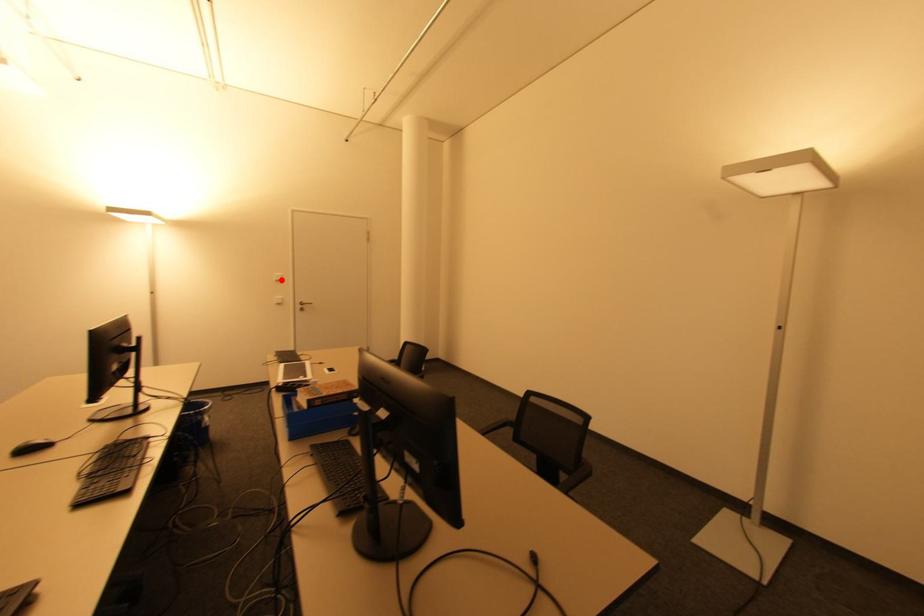
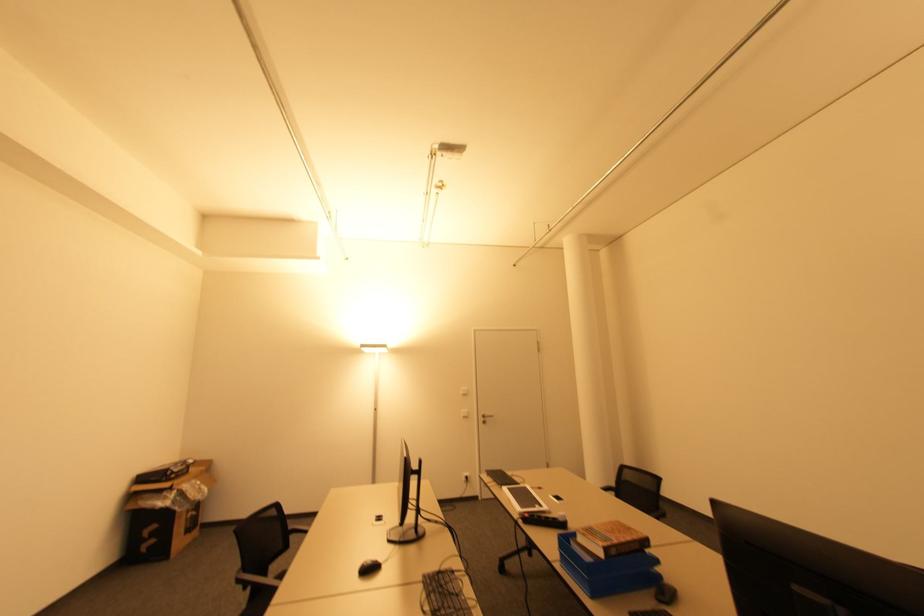
Question: I am providing you with two images of the same scene from different viewpoints. In image1, a red point is highlighted. Considering the same 3D point in image2, which of the following is correct?

Choices:
 (A) It is closer
 (B) It is farther

Answer: (B)